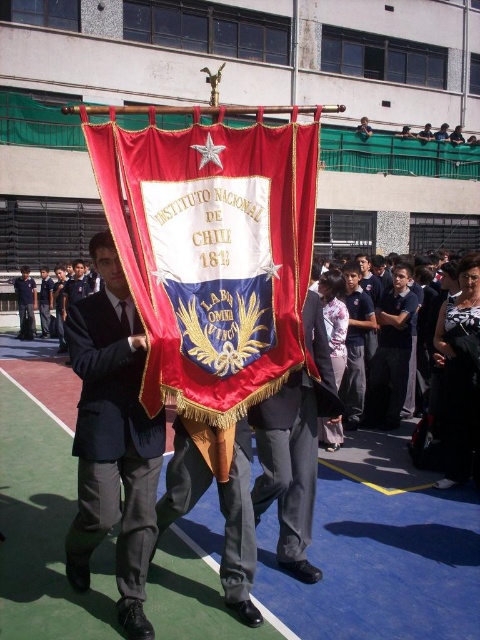
Question: Which of the following is the farthest from the observer?

Choices:
 (A) matte black pants at center
 (B) dark gray suit at center

Answer: (A)

Question: Does velvet red flag at center have a lesser width compared to dark gray suit at center?

Choices:
 (A) no
 (B) yes

Answer: (A)

Question: Which point is farther to the camera?

Choices:
 (A) velvet red flag at center
 (B) matte black pants at center
 (C) dark gray suit at center

Answer: (B)

Question: Among these points, which one is farthest from the camera?

Choices:
 (A) (197, 221)
 (B) (91, 243)
 (C) (284, 486)

Answer: (B)

Question: Observing the image, what is the correct spatial positioning of velvet red flag at center in reference to dark gray suit at center?

Choices:
 (A) below
 (B) above

Answer: (B)

Question: Does dark gray suit at center appear under matte black pants at center?

Choices:
 (A) yes
 (B) no

Answer: (B)